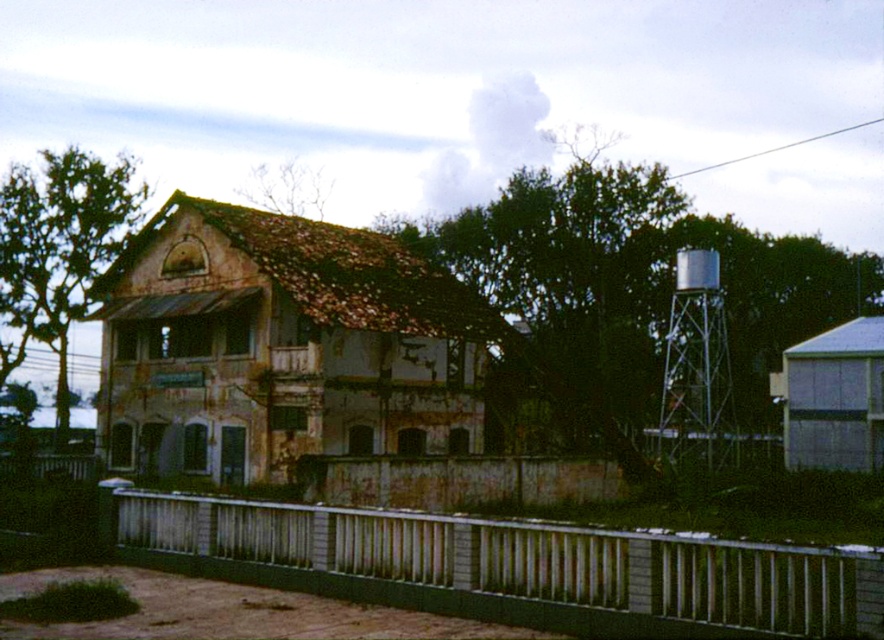
Does white painted metal fence at lower center have a greater width compared to silver metallic water tower at right?

Correct, the width of white painted metal fence at lower center exceeds that of silver metallic water tower at right.

Which is in front, point (608, 557) or point (702, 333)?

Point (608, 557) is more forward.

Between point (837, 609) and point (671, 384), which one is positioned behind?

Positioned behind is point (671, 384).

The height and width of the screenshot is (640, 884). I want to click on white painted metal fence at lower center, so click(513, 564).